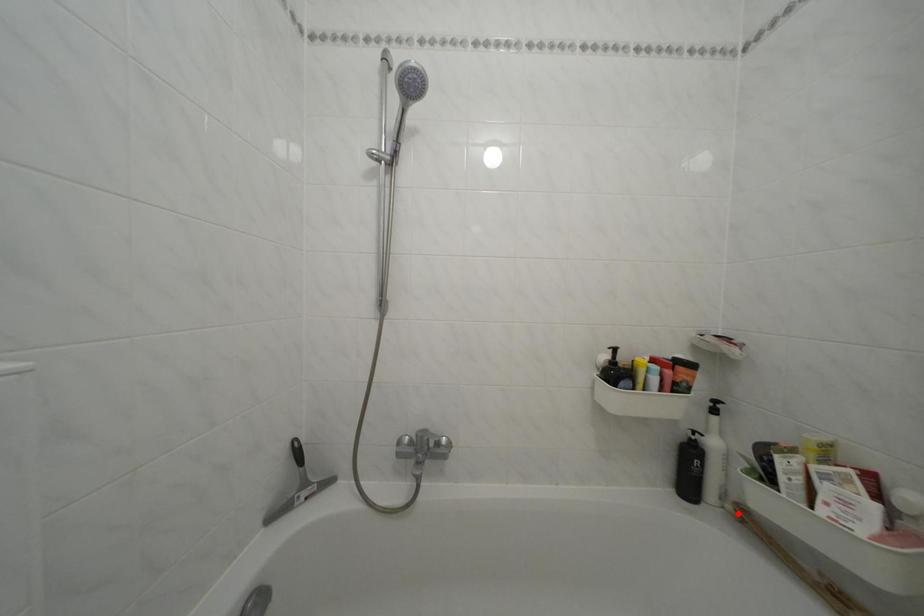
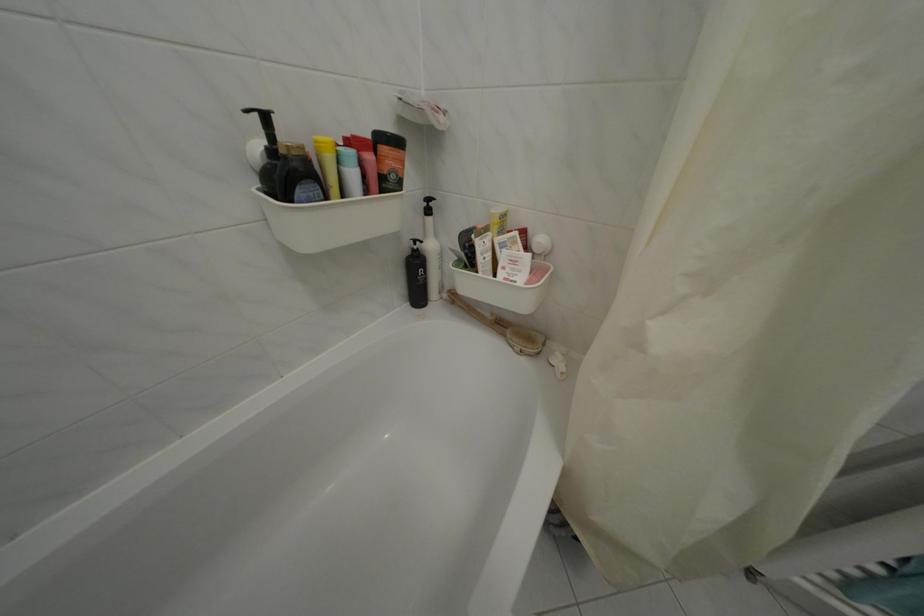
Question: I am providing you with two images of the same scene from different viewpoints. A red point is marked on the first image. At the location where the point appears in image 1, is it still visible in image 2?

Choices:
 (A) Yes
 (B) No

Answer: (A)